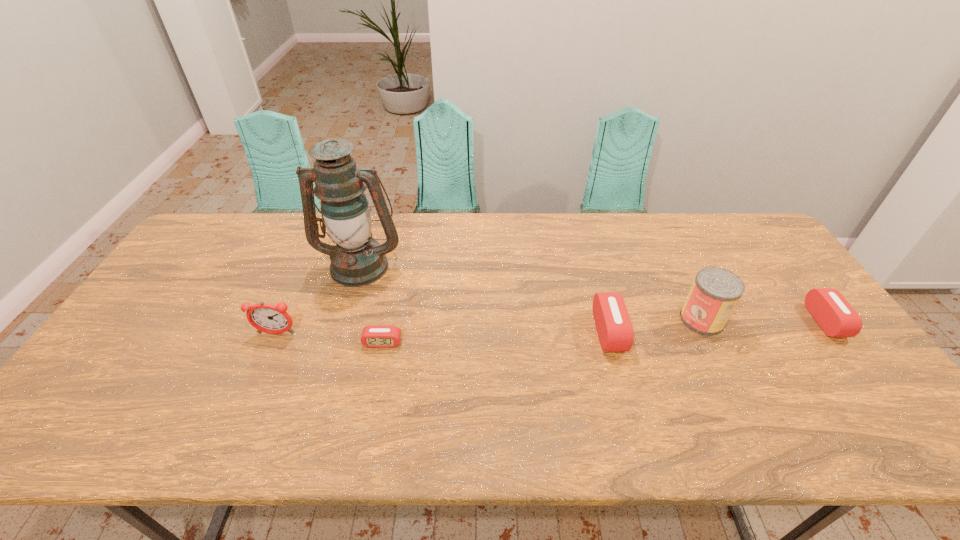
Where is `vacant space at the left edge of the desktop`? vacant space at the left edge of the desktop is located at coordinates (152, 349).

Identify the location of free location at the right edge. (750, 286).

Where is `vacant space at the far left corner of the desktop`? vacant space at the far left corner of the desktop is located at coordinates (223, 252).

Identify the location of free space between the rightmost object and the tallest object. (592, 293).

Find the location of a particular element. The image size is (960, 540). vacant space that is in between the third tallest object and the tallest object is located at coordinates (319, 299).

What are the coordinates of `free space between the second alarm clock from left to right and the third object from right to left` in the screenshot? It's located at (495, 337).

This screenshot has width=960, height=540. Identify the location of free space between the tallest alarm clock and the rightmost object. (551, 327).

Locate an element on the screen. The width and height of the screenshot is (960, 540). blank region between the second alarm clock from right to left and the tallest object is located at coordinates [x=485, y=298].

Find the location of `vacant area that lies between the tallest object and the third object from right to left`. vacant area that lies between the tallest object and the third object from right to left is located at coordinates (485, 298).

The image size is (960, 540). In order to click on free space between the farthest object and the fifth object from left to right in this screenshot , I will do `click(531, 292)`.